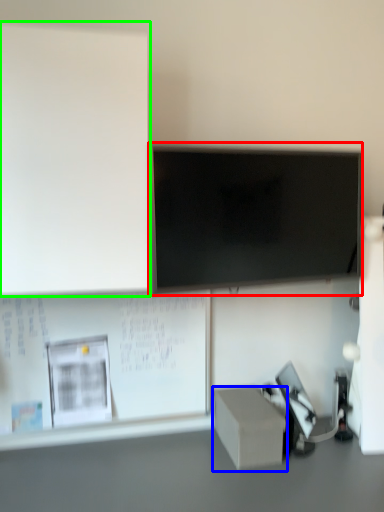
Question: Based on their relative distances, which object is nearer to television (highlighted by a red box)? Choose from box (highlighted by a blue box) and bulletin board (highlighted by a green box).

Choices:
 (A) box
 (B) bulletin board

Answer: (B)